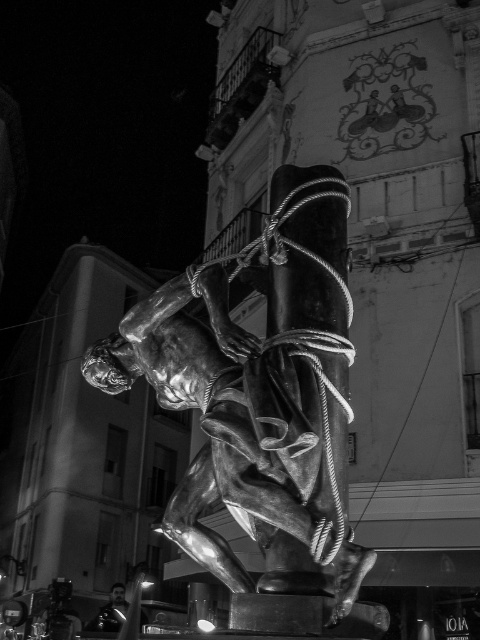
Is point (331, 401) more distant than point (117, 612)?

No, (331, 401) is in front of (117, 612).

Is shiny bronze statue at center wider than shiny black helmet at lower left?

Yes, shiny bronze statue at center is wider than shiny black helmet at lower left.

Is point (210, 419) less distant than point (113, 628)?

Yes, point (210, 419) is closer to viewer.

Image resolution: width=480 pixels, height=640 pixels. I want to click on shiny bronze statue at center, so click(x=259, y=388).